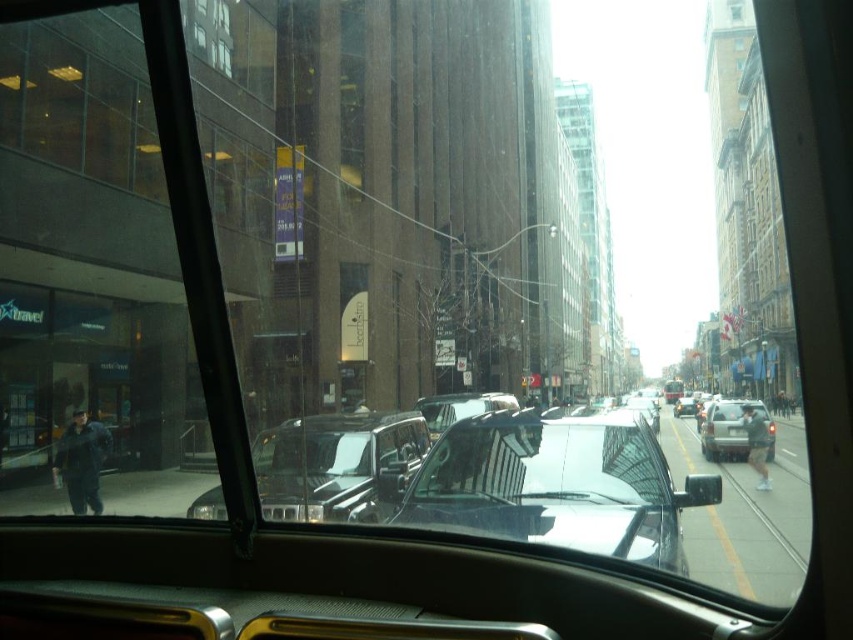
Looking at this image, how far apart are transparent glass windshield at center and silver metallic suv at center?

transparent glass windshield at center is 62.99 feet from silver metallic suv at center.

Does transparent glass windshield at center lie in front of silver metallic suv at center?

Yes, transparent glass windshield at center is in front of silver metallic suv at center.

Does point (515, 461) lie behind point (740, 436)?

No, it is not.

At what (x,y) coordinates should I click in order to perform the action: click on transparent glass windshield at center. Please return your answer as a coordinate pair (x, y). This screenshot has width=853, height=640. Looking at the image, I should click on (552, 484).